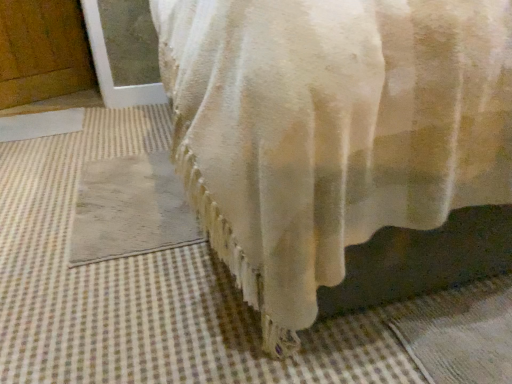
Describe the element at coordinates (331, 131) in the screenshot. I see `white textured curtain at center` at that location.

In order to click on white textured curtain at center in this screenshot , I will do `click(331, 131)`.

Locate an element on the screen. white textured curtain at center is located at coordinates (331, 131).